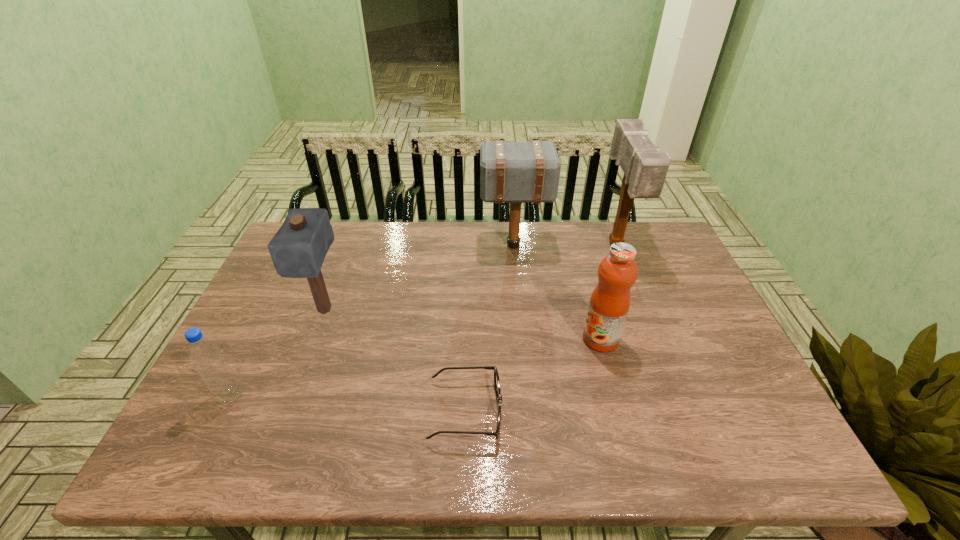
The image size is (960, 540). I want to click on water bottle that is at the left edge, so click(x=206, y=356).

Identify the location of object at the right edge. (645, 169).

Identify the location of object that is at the far right corner. The height and width of the screenshot is (540, 960). (645, 169).

Identify the location of vacant space at the far edge of the desktop. (467, 240).

This screenshot has height=540, width=960. What are the coordinates of `vacant space at the near edge of the desktop` in the screenshot? It's located at (651, 451).

I want to click on blank space at the left edge, so click(x=280, y=289).

Find the location of a particular element. vacant region at the right edge of the desktop is located at coordinates (642, 284).

In the image, there is a desktop. Identify the location of vacant region at the far right corner. (636, 233).

Identify the location of vacant area that lies between the second shortest object and the fifth object from left to right. (416, 368).

Locate an element on the screen. empty space between the second mallet from right to left and the rightmost object is located at coordinates (564, 245).